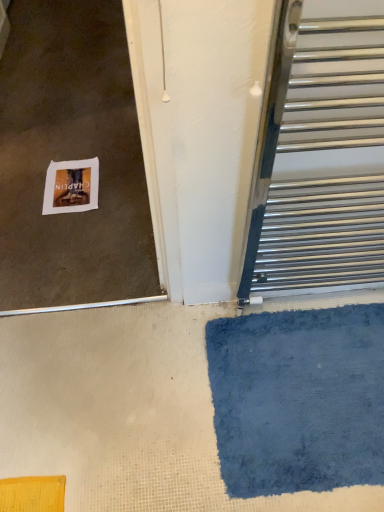
Question: From a real-world perspective, does blue plush bath mat at lower right sit lower than polished metal towel rack at right?

Choices:
 (A) no
 (B) yes

Answer: (B)

Question: From a real-world perspective, is blue plush bath mat at lower right on polished metal towel rack at right?

Choices:
 (A) yes
 (B) no

Answer: (B)

Question: Are blue plush bath mat at lower right and polished metal towel rack at right located far from each other?

Choices:
 (A) yes
 (B) no

Answer: (B)

Question: Is blue plush bath mat at lower right at the right side of polished metal towel rack at right?

Choices:
 (A) yes
 (B) no

Answer: (B)

Question: From the image's perspective, is blue plush bath mat at lower right located above polished metal towel rack at right?

Choices:
 (A) yes
 (B) no

Answer: (B)

Question: From the image's perspective, is polished metal towel rack at right positioned above or below white paper at lower left?

Choices:
 (A) below
 (B) above

Answer: (A)

Question: Relative to white paper at lower left, is polished metal towel rack at right in front or behind?

Choices:
 (A) behind
 (B) front

Answer: (B)

Question: Considering the positions of polished metal towel rack at right and white paper at lower left in the image, is polished metal towel rack at right bigger or smaller than white paper at lower left?

Choices:
 (A) small
 (B) big

Answer: (B)

Question: Considering the positions of point (382, 219) and point (94, 160), is point (382, 219) closer or farther from the camera than point (94, 160)?

Choices:
 (A) farther
 (B) closer

Answer: (B)

Question: Is point (279, 184) positioned closer to the camera than point (261, 414)?

Choices:
 (A) farther
 (B) closer

Answer: (B)

Question: Looking at their shapes, would you say polished metal towel rack at right is wider or thinner than blue plush bath mat at lower right?

Choices:
 (A) wide
 (B) thin

Answer: (B)

Question: Is polished metal towel rack at right taller or shorter than blue plush bath mat at lower right?

Choices:
 (A) short
 (B) tall

Answer: (B)

Question: Is polished metal towel rack at right in front of or behind blue plush bath mat at lower right in the image?

Choices:
 (A) front
 (B) behind

Answer: (A)

Question: Considering the positions of blue plush bath mat at lower right and polished metal towel rack at right in the image, is blue plush bath mat at lower right bigger or smaller than polished metal towel rack at right?

Choices:
 (A) big
 (B) small

Answer: (B)

Question: Choose the correct answer: Is blue plush bath mat at lower right inside polished metal towel rack at right or outside it?

Choices:
 (A) outside
 (B) inside

Answer: (A)